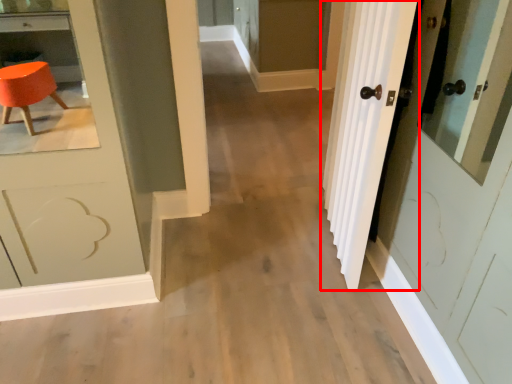
Question: Where is door (annotated by the red box) located in relation to screen door in the image?

Choices:
 (A) left
 (B) right

Answer: (B)